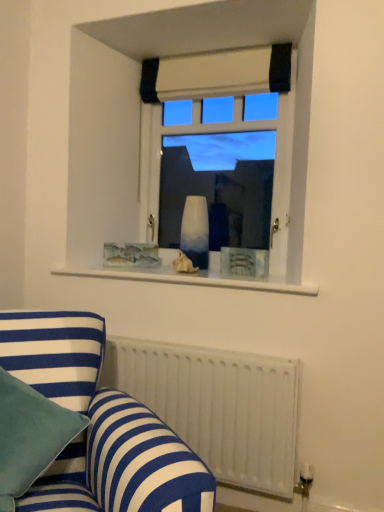
Question: Choose the correct answer: Is white metallic radiator at lower right inside white glass vase at upper center or outside it?

Choices:
 (A) outside
 (B) inside

Answer: (A)

Question: From the image's perspective, is white metallic radiator at lower right located above or below white glass vase at upper center?

Choices:
 (A) above
 (B) below

Answer: (B)

Question: Which object is positioned farthest from the white metallic radiator at lower right?

Choices:
 (A) blue striped fabric couch at lower left
 (B) white glass vase at upper center
 (C) white glass vase at center
 (D) beige fabric curtain at upper center
 (E) teal velvet pillow at lower left

Answer: (D)

Question: Which object is the closest to the white metallic radiator at lower right?

Choices:
 (A) teal velvet pillow at lower left
 (B) blue striped fabric couch at lower left
 (C) white glass vase at upper center
 (D) beige fabric curtain at upper center
 (E) white glass vase at center

Answer: (B)